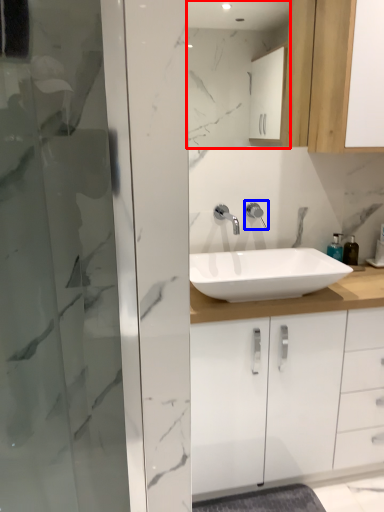
Question: Which point is further to the camera, mirror (highlighted by a red box) or tap (highlighted by a blue box)?

Choices:
 (A) mirror
 (B) tap

Answer: (B)